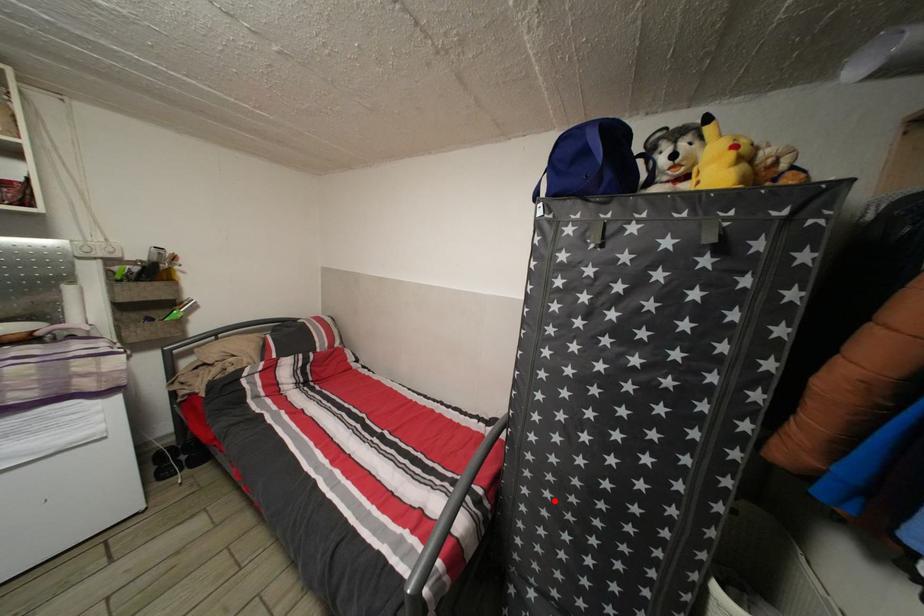
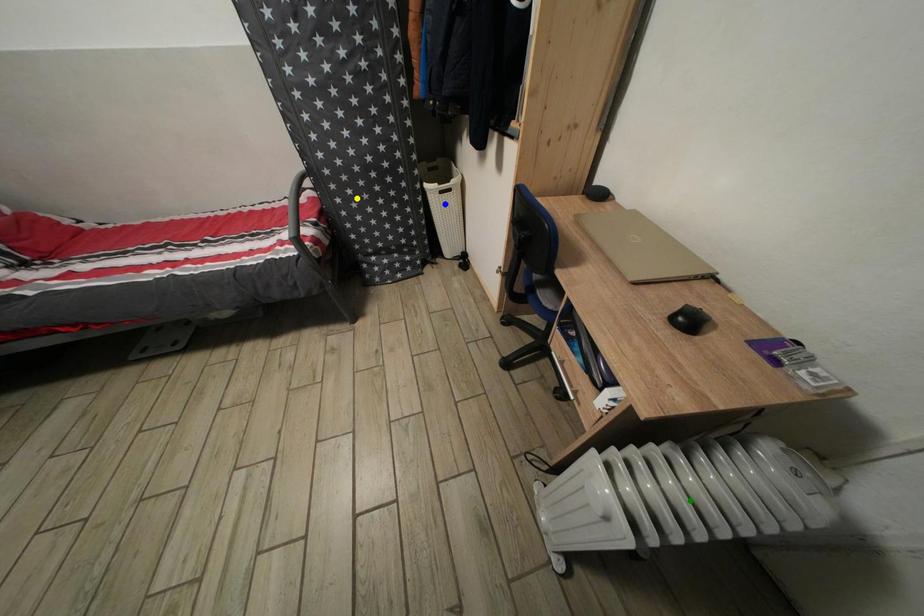
Question: I am providing you with two images of the same scene from different viewpoints. A red point is marked on the first image. You are given multiple points on the second image. Can you choose the point in image 2 that corresponds to the point in image 1?

Choices:
 (A) yellow point
 (B) green point
 (C) blue point

Answer: (A)